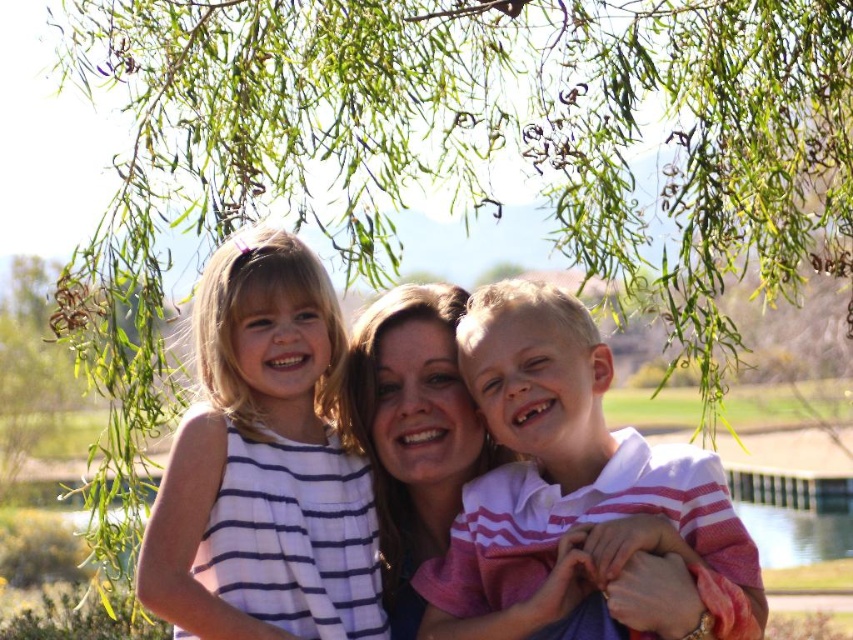
Question: Can you confirm if white striped dress at center is smaller than white striped shirt at center?

Choices:
 (A) no
 (B) yes

Answer: (B)

Question: From the image, what is the correct spatial relationship of white striped dress at center in relation to white striped shirt at center?

Choices:
 (A) right
 (B) left

Answer: (B)

Question: Can you confirm if white striped dress at center is positioned above white striped shirt at center?

Choices:
 (A) yes
 (B) no

Answer: (A)

Question: Which of the following is the farthest from the observer?

Choices:
 (A) white striped shirt at center
 (B) white striped dress at center

Answer: (B)

Question: Which of the following is the farthest from the observer?

Choices:
 (A) (160, 490)
 (B) (576, 388)

Answer: (B)

Question: Which point is closer to the camera?

Choices:
 (A) (515, 344)
 (B) (201, 333)

Answer: (A)